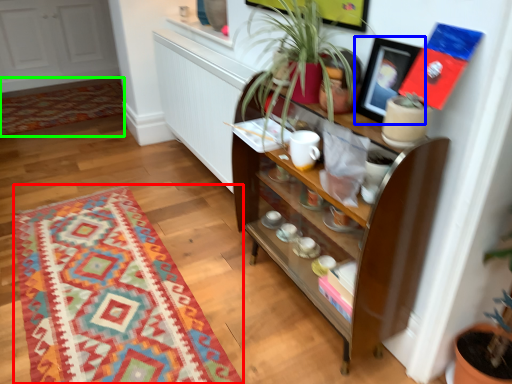
Question: Estimate the real-world distances between objects in this image. Which object is farther from mat (highlighted by a red box), picture frame (highlighted by a blue box) or mat (highlighted by a green box)?

Choices:
 (A) picture frame
 (B) mat

Answer: (B)